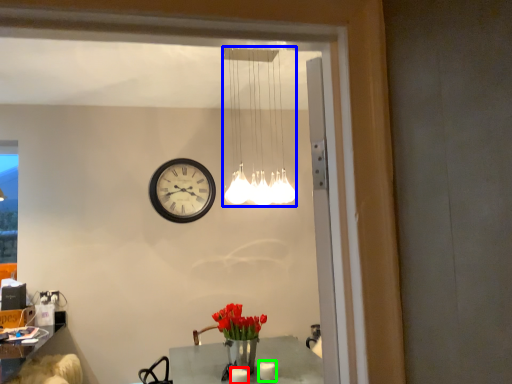
Question: Which is farther away from candle (highlighted by a red box)? lamp (highlighted by a blue box) or candle (highlighted by a green box)?

Choices:
 (A) lamp
 (B) candle

Answer: (A)